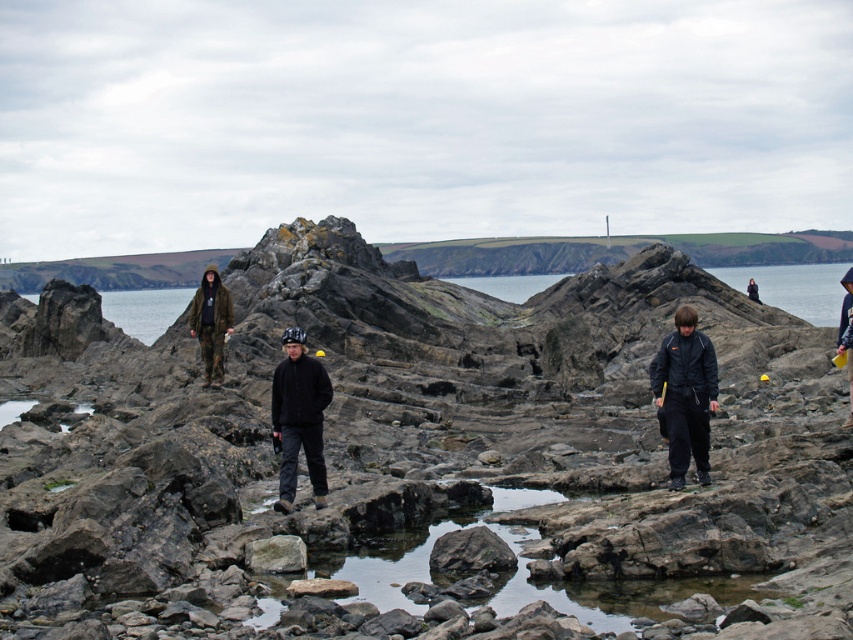
Which is more to the right, camouflage pants at center or dark blue jacket at right?

From the viewer's perspective, dark blue jacket at right appears more on the right side.

Describe the element at coordinates (212, 323) in the screenshot. The height and width of the screenshot is (640, 853). I see `camouflage pants at center` at that location.

Measure the distance between point (x=199, y=324) and camera.

Point (x=199, y=324) and camera are 56.14 meters apart from each other.

Image resolution: width=853 pixels, height=640 pixels. In order to click on camouflage pants at center in this screenshot , I will do `click(212, 323)`.

Can you confirm if black softshell jacket at center is bigger than dark blue jacket at right?

No, black softshell jacket at center is not bigger than dark blue jacket at right.

Can you confirm if black softshell jacket at center is thinner than dark blue jacket at right?

Yes.

Which is in front, point (312, 413) or point (851, 372)?

Positioned in front is point (312, 413).

This screenshot has height=640, width=853. I want to click on black softshell jacket at center, so click(299, 417).

Can you confirm if dark matte jacket at center is positioned to the right of clear water at center?

→ No, dark matte jacket at center is not to the right of clear water at center.

Who is more forward, (682, 451) or (549, 280)?

Positioned in front is point (682, 451).

This screenshot has height=640, width=853. What do you see at coordinates (686, 396) in the screenshot? I see `dark matte jacket at center` at bounding box center [686, 396].

You are a GUI agent. You are given a task and a screenshot of the screen. Output one action in this format:
    pyautogui.click(x=<x>, y=<y>)
    Task: Click on the dark matte jacket at center
    
    Given the screenshot: What is the action you would take?
    pyautogui.click(x=686, y=396)